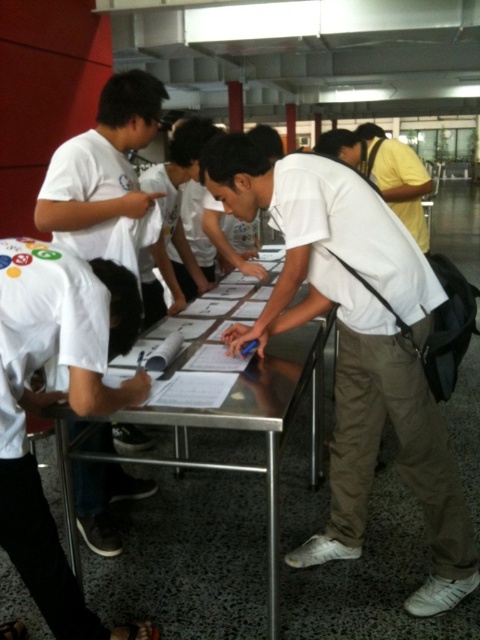
Based on the photo, you are standing in the room and want to reach the metallic silver table at center without moving the white matte shirt at left. Is the table behind or in front of the shirt?

The metallic silver table at center is behind the white matte shirt at left, so you can reach the table without moving the shirt because it is positioned behind.

You are standing in front of the table and want to reach both the point at coordinates point (106, 138) and point (143, 408). Which point should you approach first to reach the one closer to you?

You should approach point (106, 138) first because it is closer to you than point (143, 408), as stated in the description.